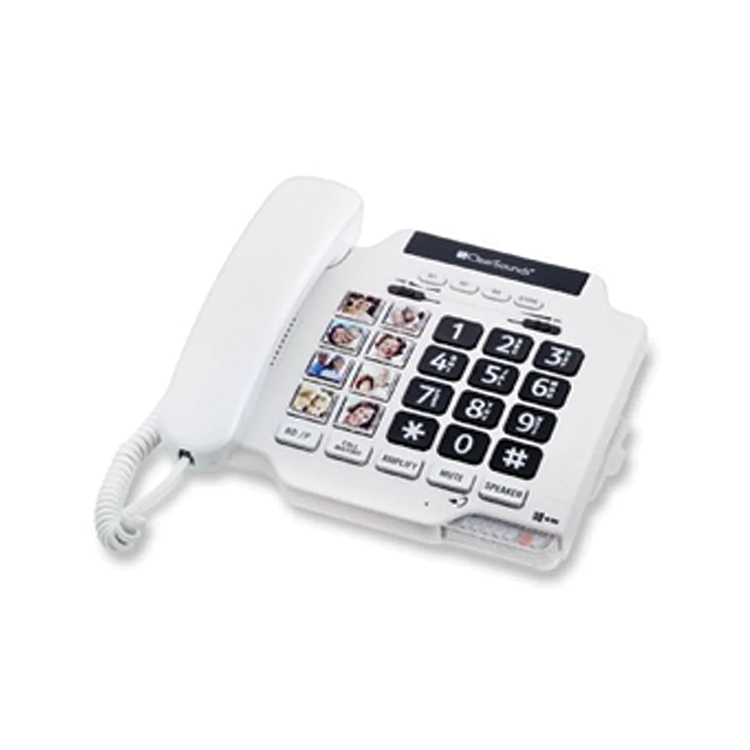
The width and height of the screenshot is (750, 750). I want to click on phone, so click(600, 415).